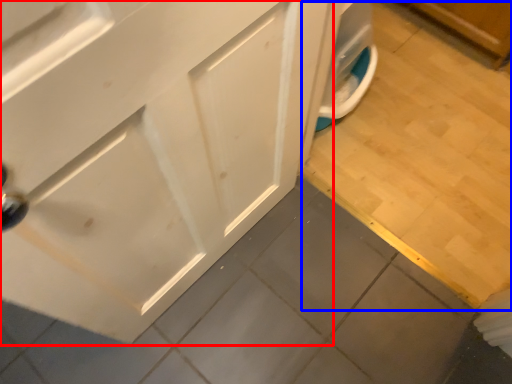
Question: Which object appears farthest to the camera in this image, cabinetry (highlighted by a red box) or tile (highlighted by a blue box)?

Choices:
 (A) cabinetry
 (B) tile

Answer: (B)